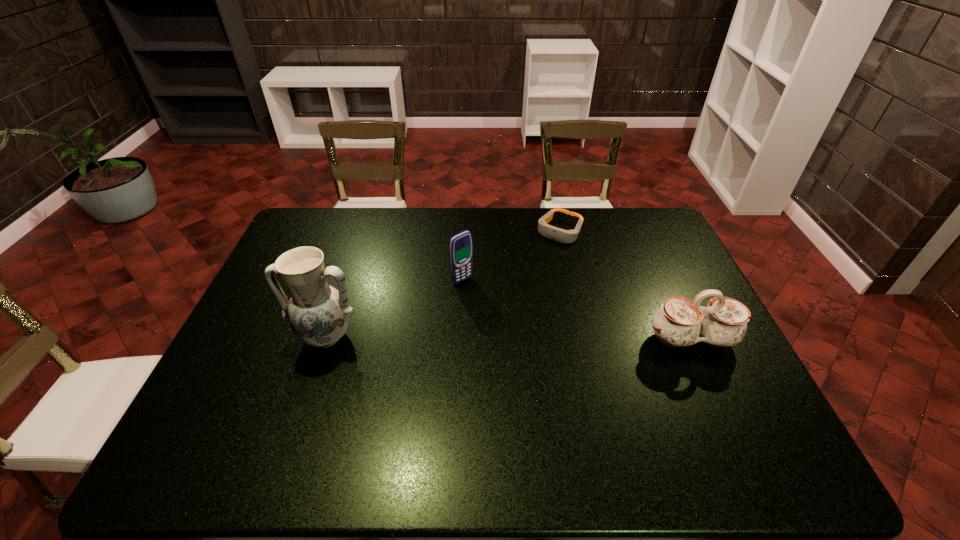
Identify the location of free space at the left edge. The height and width of the screenshot is (540, 960). (229, 362).

Find the location of `free space at the right edge of the desktop`. free space at the right edge of the desktop is located at coordinates (648, 262).

Where is `vacant region at the far left corner of the desktop`? The image size is (960, 540). vacant region at the far left corner of the desktop is located at coordinates (312, 217).

Locate an element on the screen. The width and height of the screenshot is (960, 540). free space at the near left corner of the desktop is located at coordinates (237, 393).

Where is `free area in between the chinaware and the pottery`? free area in between the chinaware and the pottery is located at coordinates (509, 338).

At what (x,y) coordinates should I click in order to perform the action: click on unoccupied area between the chinaware and the shortest object. Please return your answer as a coordinate pair (x, y). The width and height of the screenshot is (960, 540). Looking at the image, I should click on (626, 286).

This screenshot has width=960, height=540. Find the location of `vacant area between the cellular telephone and the goggles`. vacant area between the cellular telephone and the goggles is located at coordinates (511, 256).

Identify the location of vacant space in between the rightmost object and the farthest object. The height and width of the screenshot is (540, 960). (626, 286).

At what (x,y) coordinates should I click in order to perform the action: click on vacant point located between the chinaware and the pottery. Please return your answer as a coordinate pair (x, y). The image size is (960, 540). Looking at the image, I should click on (509, 338).

Locate an element on the screen. Image resolution: width=960 pixels, height=540 pixels. vacant area that lies between the tallest object and the farthest object is located at coordinates (443, 284).